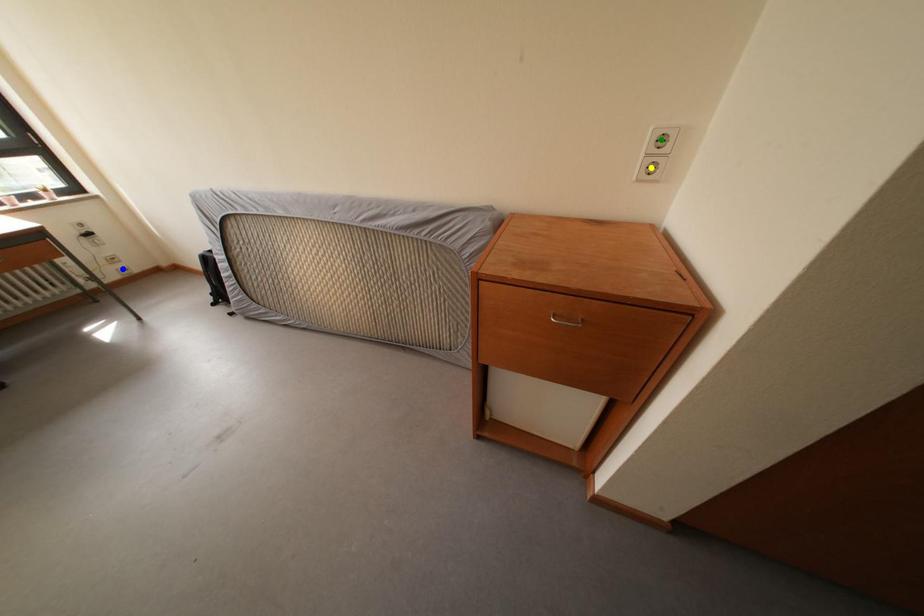
Order these from nearest to farthest:
green point, yellow point, blue point

green point < yellow point < blue point